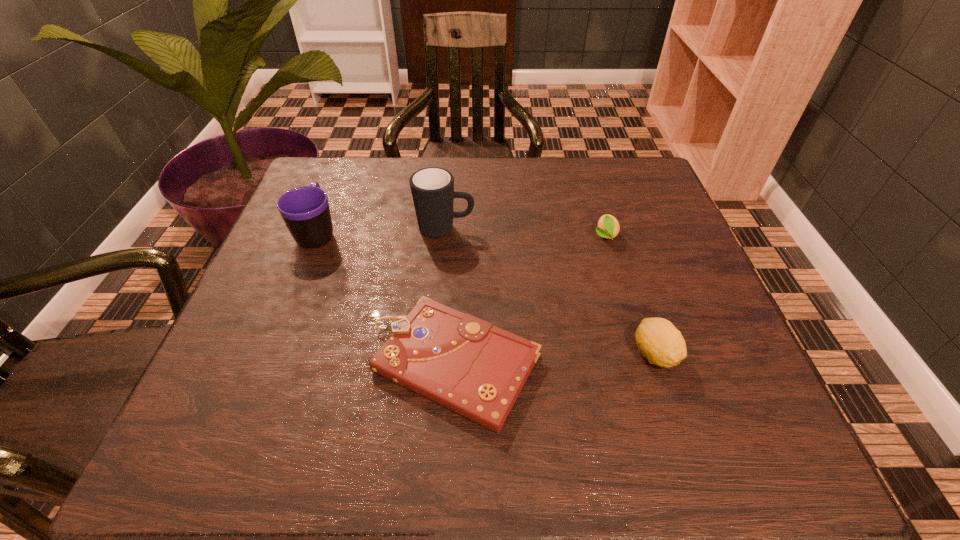
I want to click on free space located 0.120m with the handle on the side of the leftmost object, so click(x=336, y=185).

Image resolution: width=960 pixels, height=540 pixels. In order to click on free region located 0.110m with the handle on the side of the leftmost object in this screenshot , I will do `click(335, 187)`.

You are a GUI agent. You are given a task and a screenshot of the screen. Output one action in this format:
    pyautogui.click(x=<x>, y=<y>)
    Task: Click on the free spot located with the handle on the side of the leftmost object
    This screenshot has height=540, width=960.
    Given the screenshot: What is the action you would take?
    pyautogui.click(x=342, y=170)

Locate an element on the screen. Image resolution: width=960 pixels, height=540 pixels. vacant area situated at the stem end of the third tallest object is located at coordinates click(673, 410).

You are a GUI agent. You are given a task and a screenshot of the screen. Output one action in this format:
    pyautogui.click(x=<x>, y=<y>)
    Task: Click on the blank area located with leaves positioned above the farther lemon
    The image size is (960, 540).
    Given the screenshot: What is the action you would take?
    pyautogui.click(x=632, y=326)

The image size is (960, 540). What are the coordinates of `free space located on the back of the shortest object` in the screenshot? It's located at (464, 188).

Locate an element on the screen. The width and height of the screenshot is (960, 540). object that is at the near edge is located at coordinates (477, 370).

The width and height of the screenshot is (960, 540). In order to click on object that is at the left edge in this screenshot , I will do `click(305, 210)`.

This screenshot has height=540, width=960. In the image, there is a desktop. Find the location of `vacant space at the far edge`. vacant space at the far edge is located at coordinates (379, 201).

The height and width of the screenshot is (540, 960). I want to click on free spot at the near edge of the desktop, so click(487, 449).